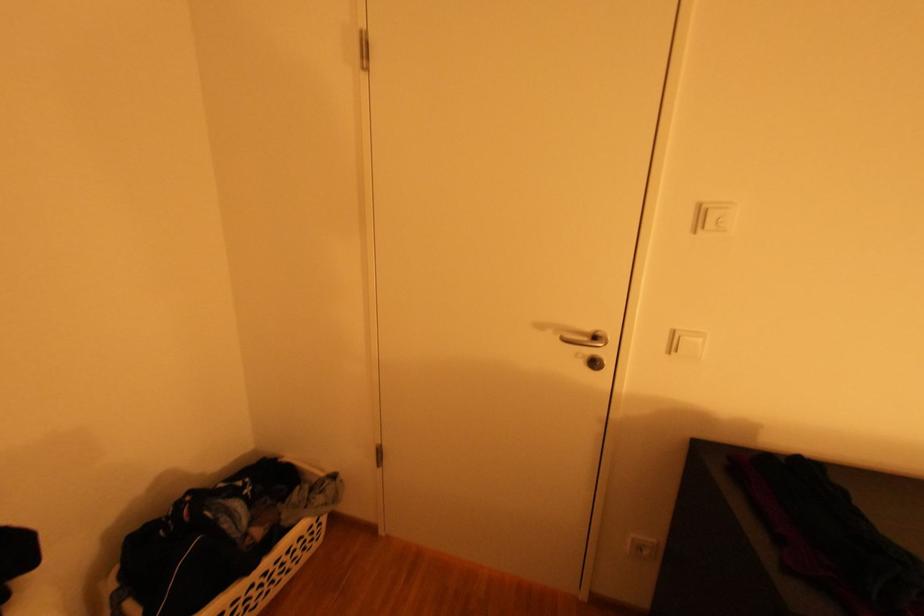
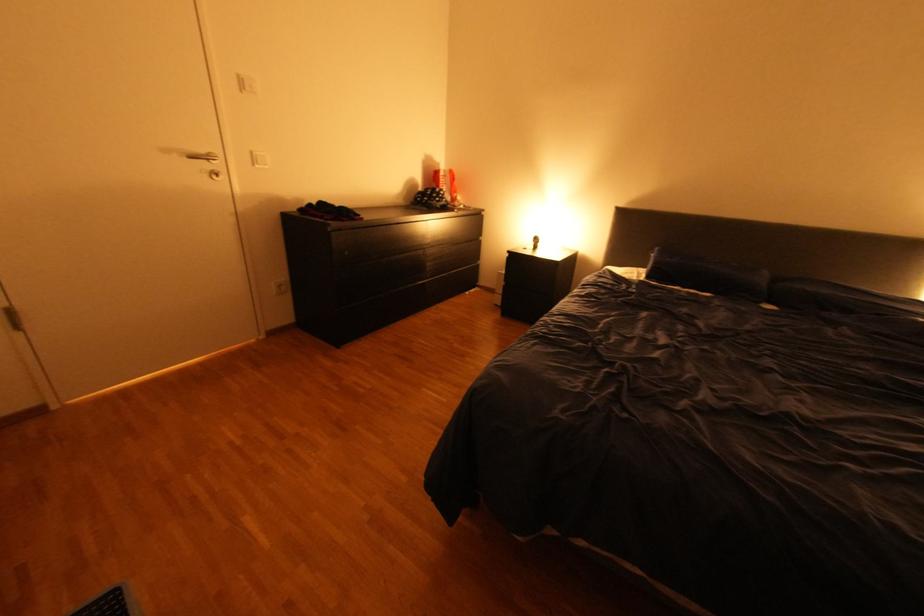
Locate, in the second image, the point that corresponds to point (682, 349) in the first image.

(264, 161)